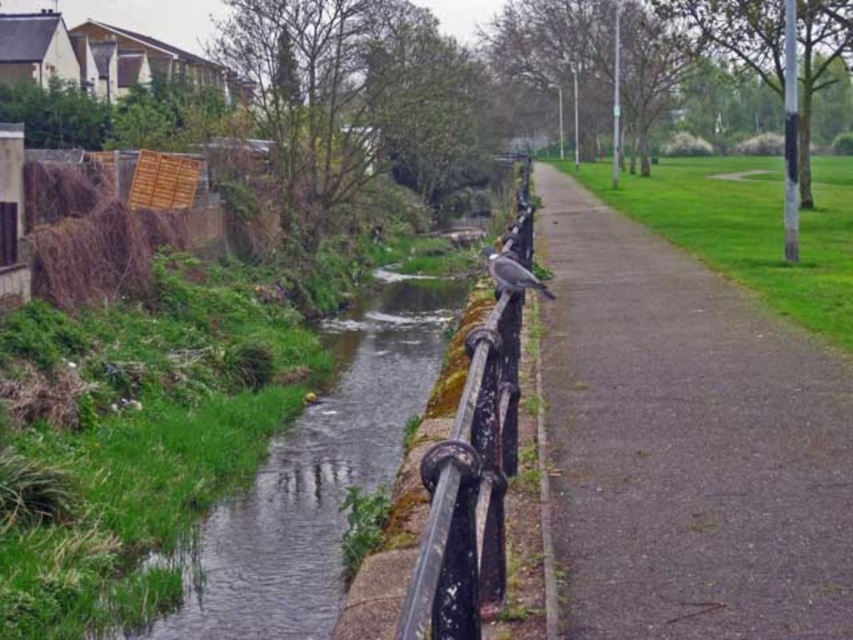
You are standing at point (685, 442) in the park. What material are you currently standing on?

You are standing on gray asphalt pavement at center.